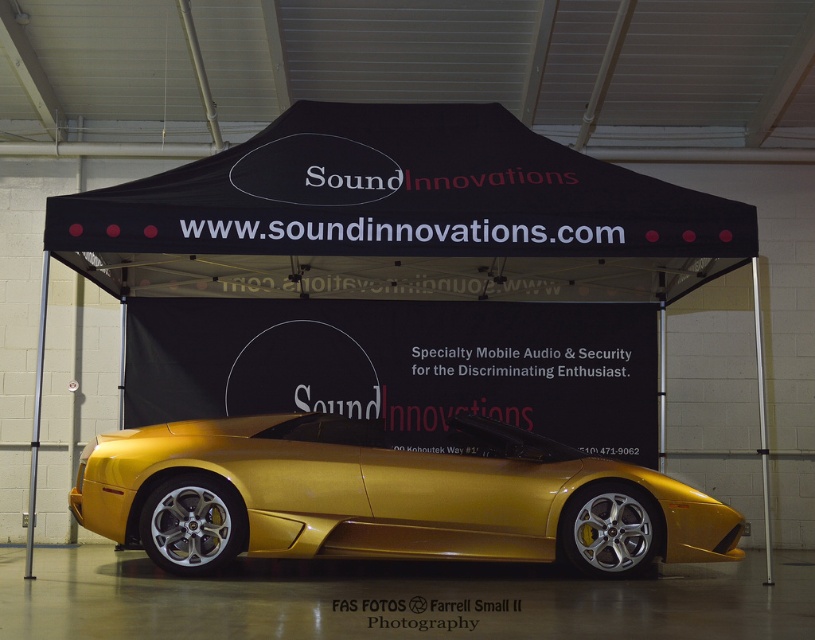
Question: Does black fabric tent at center come behind gold metallic sports car at center?

Choices:
 (A) yes
 (B) no

Answer: (A)

Question: Which point is farther to the camera?

Choices:
 (A) black fabric tent at center
 (B) gold metallic sports car at center

Answer: (A)

Question: Is black fabric tent at center in front of gold metallic sports car at center?

Choices:
 (A) yes
 (B) no

Answer: (B)

Question: Does black fabric tent at center lie in front of gold metallic sports car at center?

Choices:
 (A) yes
 (B) no

Answer: (B)

Question: Which point appears farthest from the camera in this image?

Choices:
 (A) (684, 554)
 (B) (664, 216)

Answer: (B)